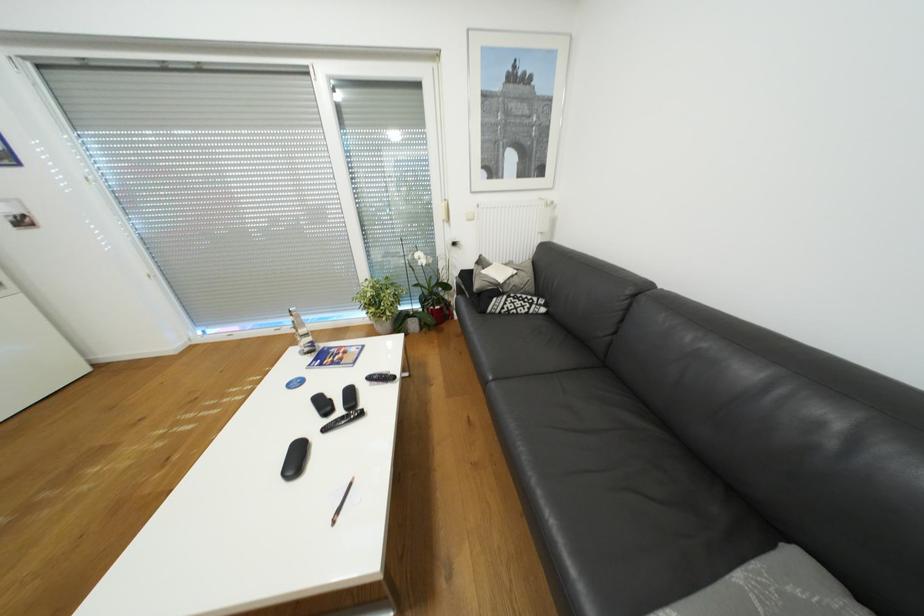
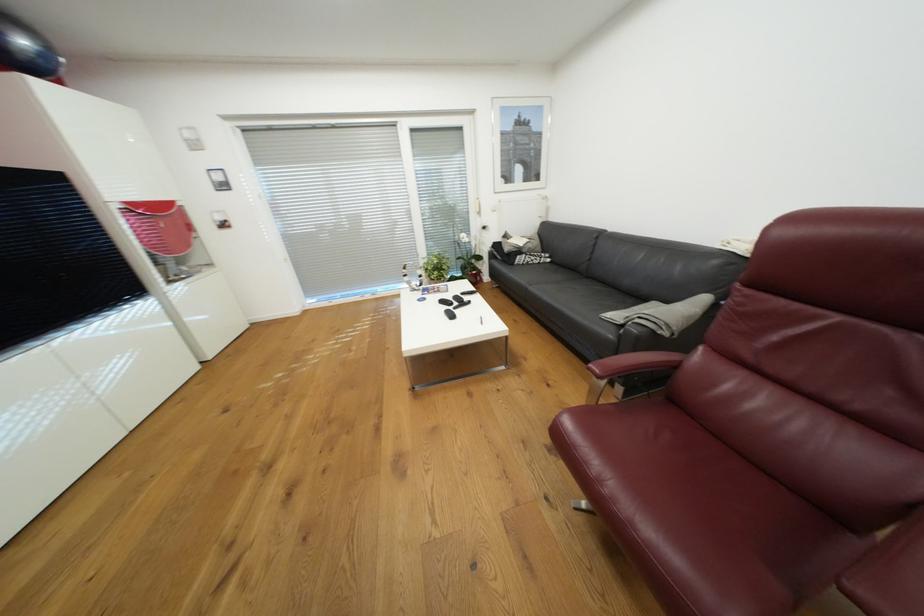
What movement of the cameraman would produce the second image?

The movement direction of the cameraman is left, backward.